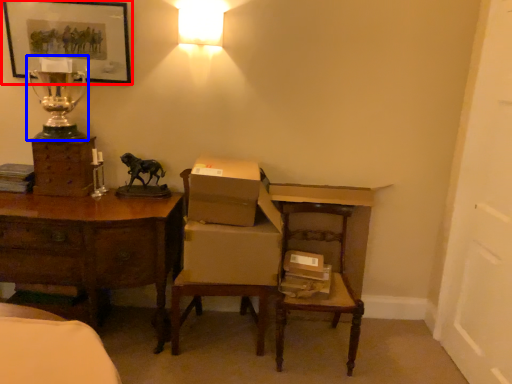
Question: Among these objects, which one is farthest to the camera, picture frame (highlighted by a red box) or table lamp (highlighted by a blue box)?

Choices:
 (A) picture frame
 (B) table lamp

Answer: (A)